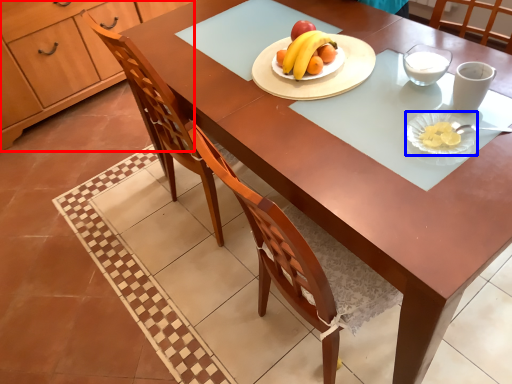
Question: Among these objects, which one is nearest to the camera, cabinetry (highlighted by a red box) or platter (highlighted by a blue box)?

Choices:
 (A) cabinetry
 (B) platter

Answer: (B)